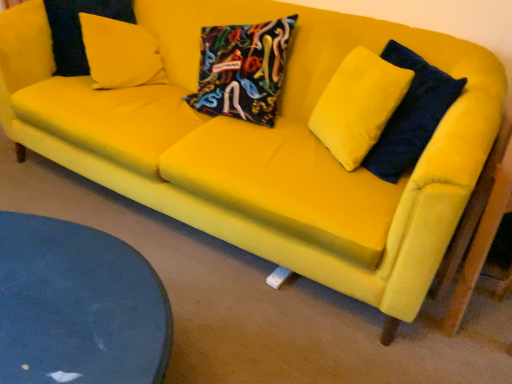
Locate an element on the screen. The width and height of the screenshot is (512, 384). free spot to the left of wooden side table at right is located at coordinates (403, 335).